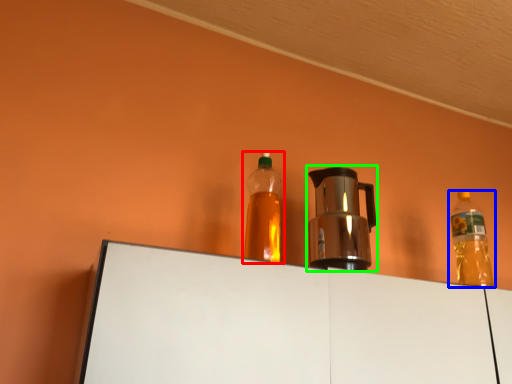
Question: Which object is positioned closest to bottle (highlighted by a red box)? Select from bottle (highlighted by a blue box) and coffeepot (highlighted by a green box).

Choices:
 (A) bottle
 (B) coffeepot

Answer: (B)